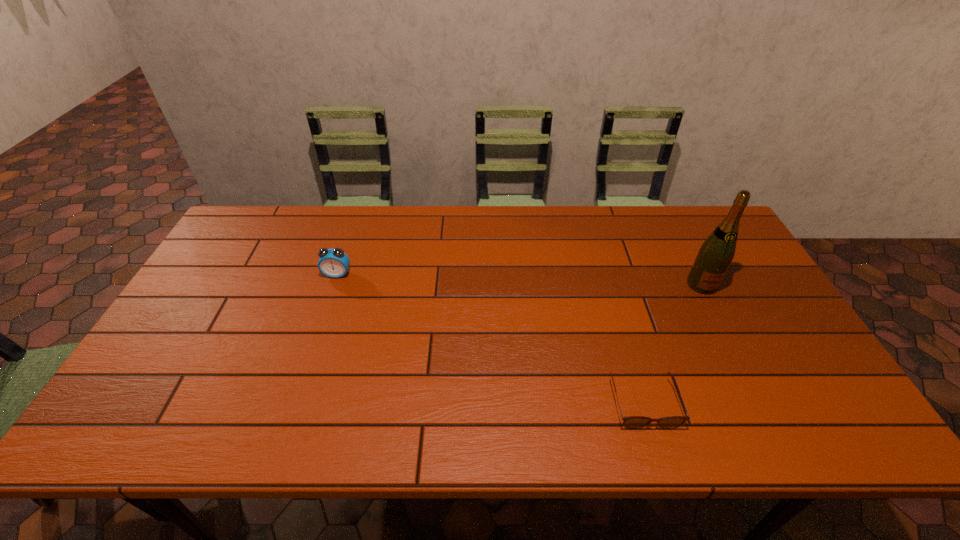
Where is `wine bottle`? wine bottle is located at coordinates (715, 255).

Find the location of `the rightmost object`. the rightmost object is located at coordinates (715, 255).

Where is `the leftmost object`? Image resolution: width=960 pixels, height=540 pixels. the leftmost object is located at coordinates (334, 263).

At what (x,y) coordinates should I click in order to perform the action: click on the second shortest object. Please return your answer as a coordinate pair (x, y). This screenshot has height=540, width=960. Looking at the image, I should click on (334, 263).

I want to click on the second object from right to left, so click(630, 422).

Locate an element on the screen. Image resolution: width=960 pixels, height=540 pixels. the nearest object is located at coordinates (630, 422).

At what (x,y) coordinates should I click in order to perform the action: click on vacant space located 0.060m on the front-facing side of the rightmost object. Please return your answer as a coordinate pair (x, y). This screenshot has height=540, width=960. Looking at the image, I should click on (715, 310).

The width and height of the screenshot is (960, 540). In order to click on vacant space located on the face of the leftmost object in this screenshot , I will do `click(299, 390)`.

I want to click on object positioned at the near edge, so click(630, 422).

This screenshot has width=960, height=540. I want to click on object situated at the right edge, so click(x=715, y=255).